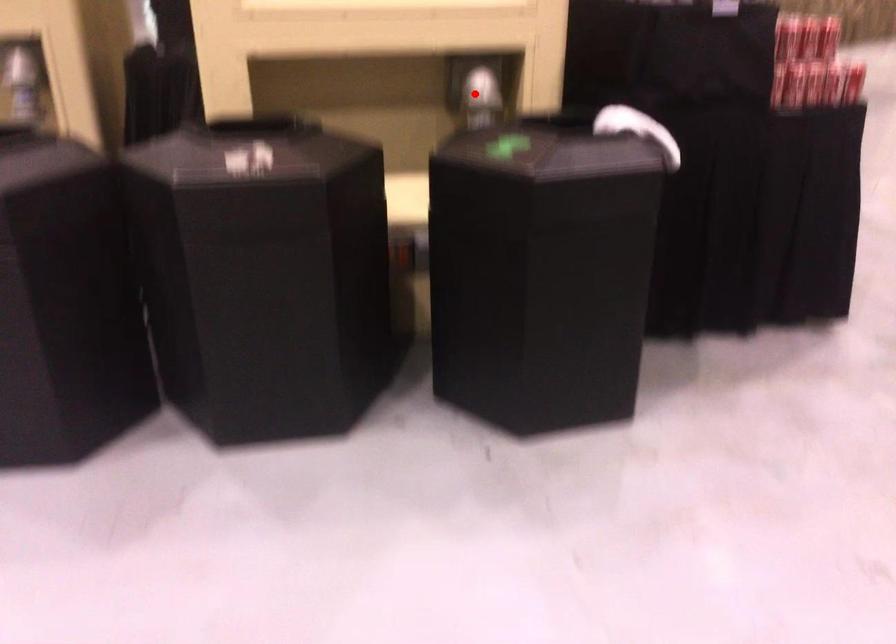
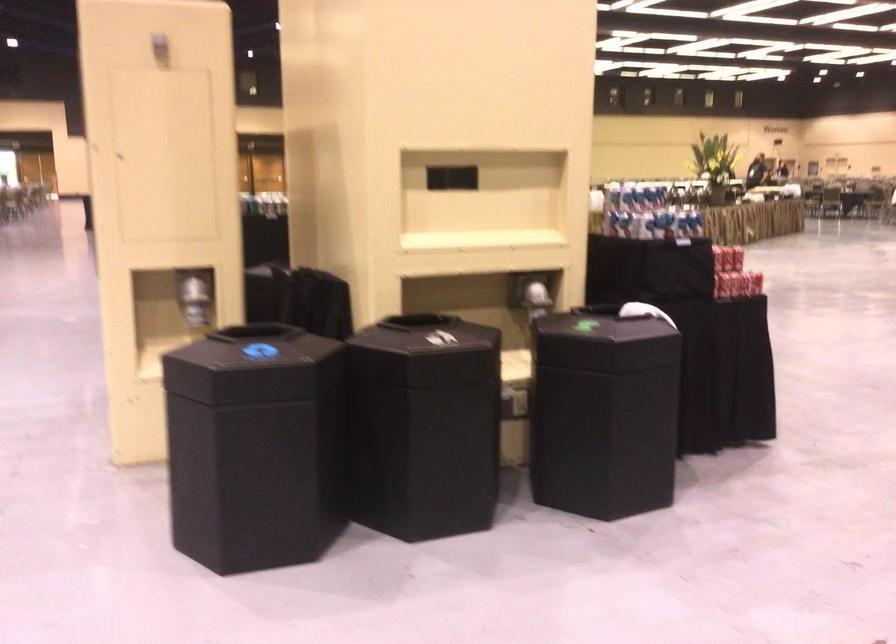
Question: I am providing you with two images of the same scene from different viewpoints. Image1 has a red point marked. In image2, the corresponding 3D location appears at what relative position? Reply with the corresponding letter.

Choices:
 (A) Closer
 (B) Farther

Answer: (B)